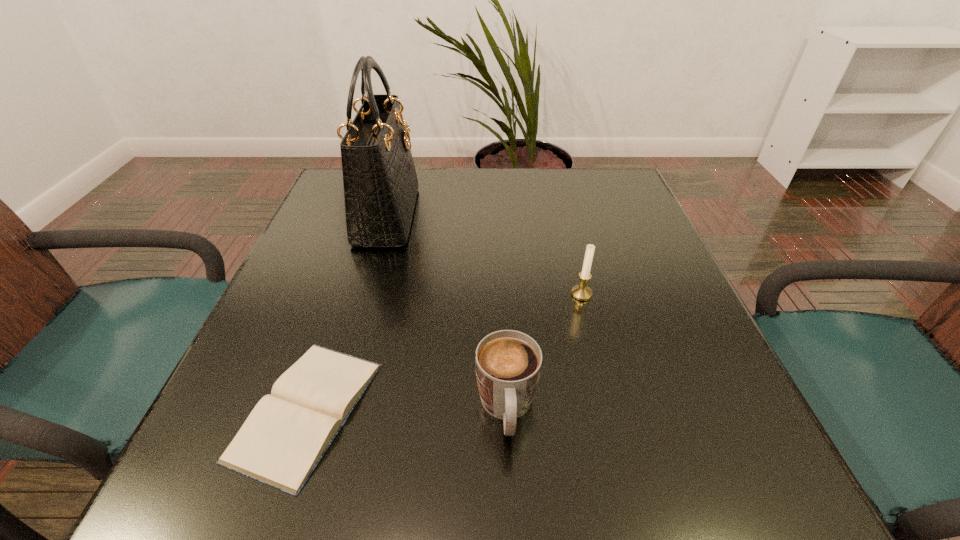
You are a GUI agent. You are given a task and a screenshot of the screen. Output one action in this format:
    pyautogui.click(x=<x>, y=<y>)
    Task: Click on the object at the far edge
    
    Given the screenshot: What is the action you would take?
    pyautogui.click(x=380, y=183)

The image size is (960, 540). Find the location of `mug located in the near edge section of the desktop`. mug located in the near edge section of the desktop is located at coordinates (508, 363).

The height and width of the screenshot is (540, 960). Find the location of `Bible at the near edge`. Bible at the near edge is located at coordinates (283, 439).

Find the location of a particular element. handbag that is at the left edge is located at coordinates (380, 183).

Image resolution: width=960 pixels, height=540 pixels. In order to click on Bible located at the left edge in this screenshot , I will do `click(283, 439)`.

Identify the location of object at the far left corner. The width and height of the screenshot is (960, 540). (380, 183).

Identify the location of object present at the near left corner. This screenshot has width=960, height=540. (283, 439).

In the image, there is a desktop. At what (x,y) coordinates should I click in order to perform the action: click on free space at the far edge. Please return your answer as a coordinate pair (x, y). The height and width of the screenshot is (540, 960). Looking at the image, I should click on (476, 184).

In the image, there is a desktop. Where is `free space at the near edge`? The width and height of the screenshot is (960, 540). free space at the near edge is located at coordinates (637, 455).

Find the location of a particular element. vacant space at the left edge is located at coordinates 250,372.